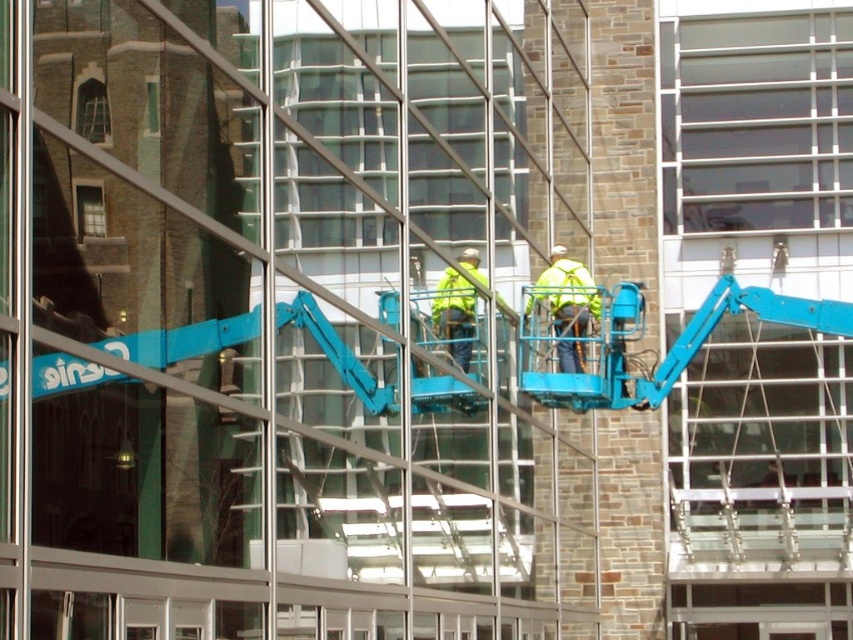
You are an architect analyzing the building facade. You notice a point at coordinates (453, 294) on the image. What object is located at that point?

The point at coordinates (453, 294) corresponds to the yellow reflective safety vest at center.

You are a window cleaner working on the building. You need to clean both the matte glass window at upper left and the clear glass window at upper left. Which window will require you to climb higher to reach the top edge?

The clear glass window at upper left has a greater height than the matte glass window at upper left, so you will need to climb higher to reach the top edge of the clear glass window at upper left.

In the scene shown: You are a window cleaner working on the building and need to clean both the matte glass window at upper left and the clear glass window at upper left. Which window should you clean first if you want to start with the larger one?

You should clean the matte glass window at upper left first because it has a larger size compared to the clear glass window at upper left.